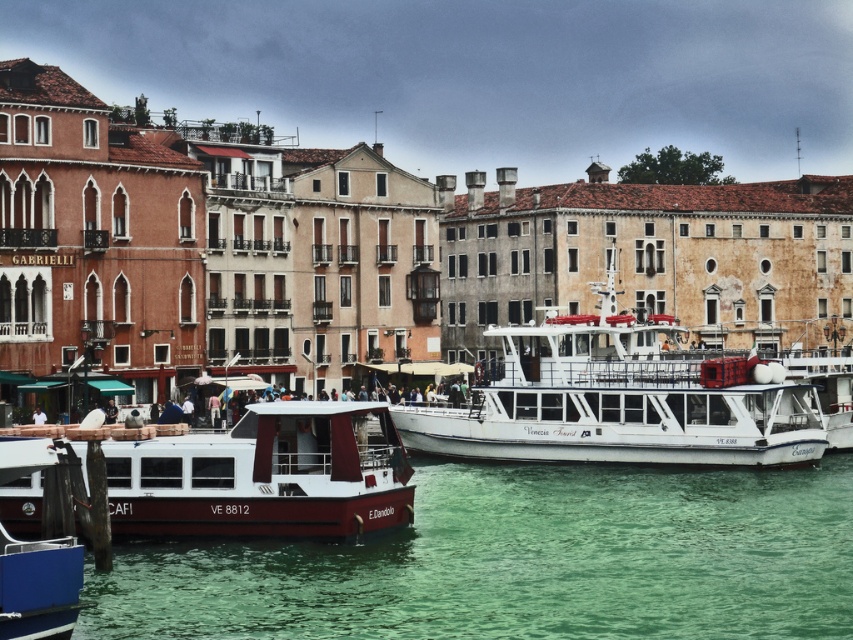
Does green translucent water at center have a greater width compared to white glossy ferry at center?

Yes, green translucent water at center is wider than white glossy ferry at center.

Describe the element at coordinates (521, 563) in the screenshot. I see `green translucent water at center` at that location.

Who is more forward, (444, 509) or (531, 444)?

Positioned in front is point (444, 509).

Locate an element on the screen. This screenshot has width=853, height=640. green translucent water at center is located at coordinates (521, 563).

Who is more forward, (213, 548) or (267, 456)?

Positioned in front is point (213, 548).

Does green translucent water at center come in front of matte red boat at lower left?

Yes.

What are the coordinates of `green translucent water at center` in the screenshot? It's located at (521, 563).

This screenshot has width=853, height=640. In order to click on green translucent water at center in this screenshot , I will do [x=521, y=563].

Between point (492, 403) and point (260, 412), which one is positioned behind?

Positioned behind is point (492, 403).

Which is below, white glossy ferry at center or matte red boat at lower left?

matte red boat at lower left is below.

Where is `white glossy ferry at center`? The height and width of the screenshot is (640, 853). white glossy ferry at center is located at coordinates (619, 400).

This screenshot has width=853, height=640. I want to click on white glossy ferry at center, so click(619, 400).